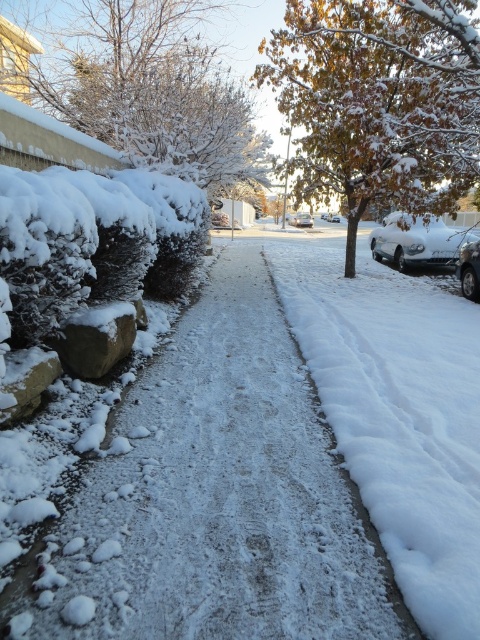
Based on the photo, you are a delivery driver who needs to park your sleek silver sedan at right in the driveway. The driveway is located at the bottom of the image. Can you park your car there?

The 2D location of sleek silver sedan at right is at point (468,269), which is near the bottom of the image, so yes, you can park your sleek silver sedan at right in the driveway located at the bottom.

You are a delivery person needing to cross the snowy pathway between the white matte car at right and the row of shrubs and bushes on the left. The pathway is 12.67 meters wide. Your delivery cart measures 1.5 meters in width. Can your cart safely navigate the path between them?

The pathway between the white matte car at right and the row of shrubs and bushes on the left is 12.67 meters wide. Since your delivery cart is only 1.5 meters wide, there is ample space for it to safely navigate the path between them.